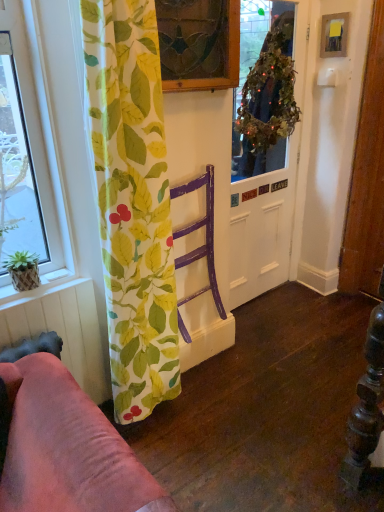
Question: Could you tell me if woven bamboo plant pot at lower left is facing stained glass window at upper center?

Choices:
 (A) no
 (B) yes

Answer: (A)

Question: Does woven bamboo plant pot at lower left appear on the left side of stained glass window at upper center?

Choices:
 (A) no
 (B) yes

Answer: (B)

Question: Considering the relative positions of woven bamboo plant pot at lower left and stained glass window at upper center in the image provided, is woven bamboo plant pot at lower left in front of stained glass window at upper center?

Choices:
 (A) yes
 (B) no

Answer: (B)

Question: From the image's perspective, is woven bamboo plant pot at lower left below stained glass window at upper center?

Choices:
 (A) yes
 (B) no

Answer: (A)

Question: Is stained glass window at upper center located within woven bamboo plant pot at lower left?

Choices:
 (A) yes
 (B) no

Answer: (B)

Question: Considering the relative positions of woven bamboo plant pot at lower left and stained glass window at upper center in the image provided, is woven bamboo plant pot at lower left to the right of stained glass window at upper center from the viewer's perspective?

Choices:
 (A) no
 (B) yes

Answer: (A)

Question: From the image's perspective, does purple wood chair at center appear higher than green woven basket at lower left?

Choices:
 (A) no
 (B) yes

Answer: (B)

Question: Is green woven basket at lower left a part of purple wood chair at center?

Choices:
 (A) yes
 (B) no

Answer: (B)

Question: Does purple wood chair at center appear on the left side of green woven basket at lower left?

Choices:
 (A) no
 (B) yes

Answer: (A)

Question: From a real-world perspective, is purple wood chair at center beneath green woven basket at lower left?

Choices:
 (A) no
 (B) yes

Answer: (B)

Question: From a real-world perspective, is purple wood chair at center on top of green woven basket at lower left?

Choices:
 (A) yes
 (B) no

Answer: (B)

Question: Can you confirm if purple wood chair at center is shorter than green woven basket at lower left?

Choices:
 (A) no
 (B) yes

Answer: (A)

Question: Can you confirm if green leafy wreath at upper center is positioned to the left of purple wood chair at center?

Choices:
 (A) no
 (B) yes

Answer: (A)